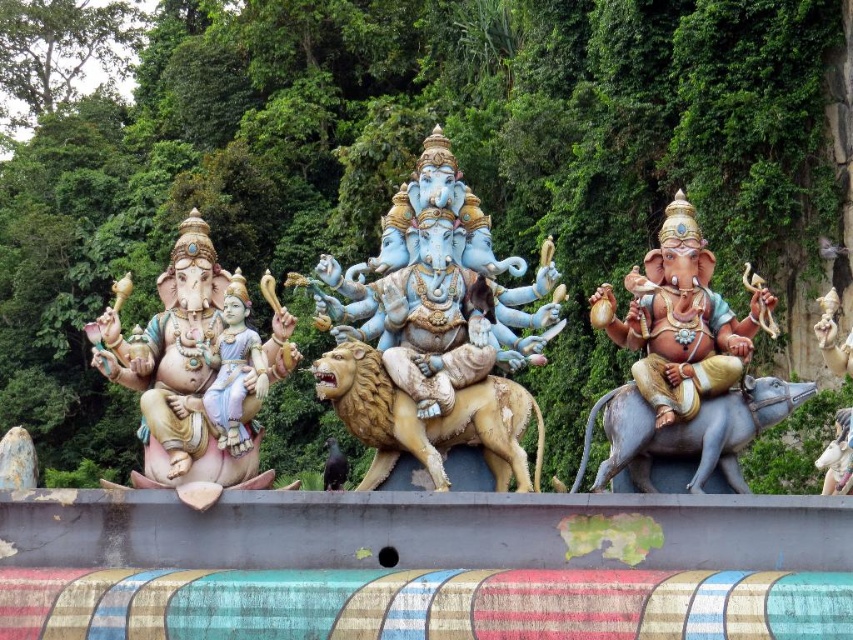
Question: Which of these objects is positioned closest to the blue stone elephant at right?

Choices:
 (A) matte gold elephant at right
 (B) golden matte lion at center
 (C) blue glossy statue at center
 (D) matte pink statue at left

Answer: (A)

Question: Does golden matte lion at center have a lesser width compared to blue stone elephant at right?

Choices:
 (A) yes
 (B) no

Answer: (A)

Question: Does matte pink statue at left have a smaller size compared to matte gold elephant at right?

Choices:
 (A) no
 (B) yes

Answer: (A)

Question: Does golden matte lion at center have a greater width compared to shiny golden lion at center?

Choices:
 (A) yes
 (B) no

Answer: (A)

Question: Among these points, which one is nearest to the camera?

Choices:
 (A) (339, 476)
 (B) (479, 241)
 (C) (643, 360)
 (D) (172, 385)

Answer: (D)

Question: Based on their relative distances, which object is nearer to the golden matte lion at center?

Choices:
 (A) blue glossy statue at center
 (B) matte gold elephant at right
 (C) shiny golden lion at center

Answer: (A)